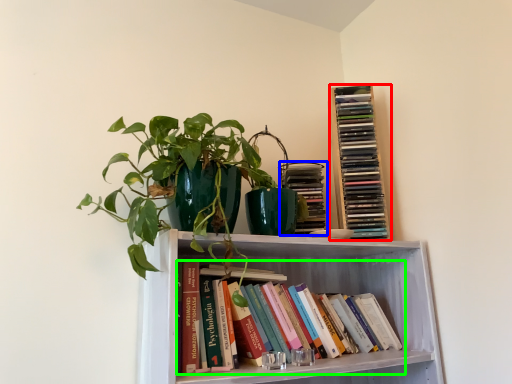
Question: Based on their relative distances, which object is nearer to book (highlighted by a red box)? Choose from book (highlighted by a blue box) and book (highlighted by a green box).

Choices:
 (A) book
 (B) book

Answer: (A)